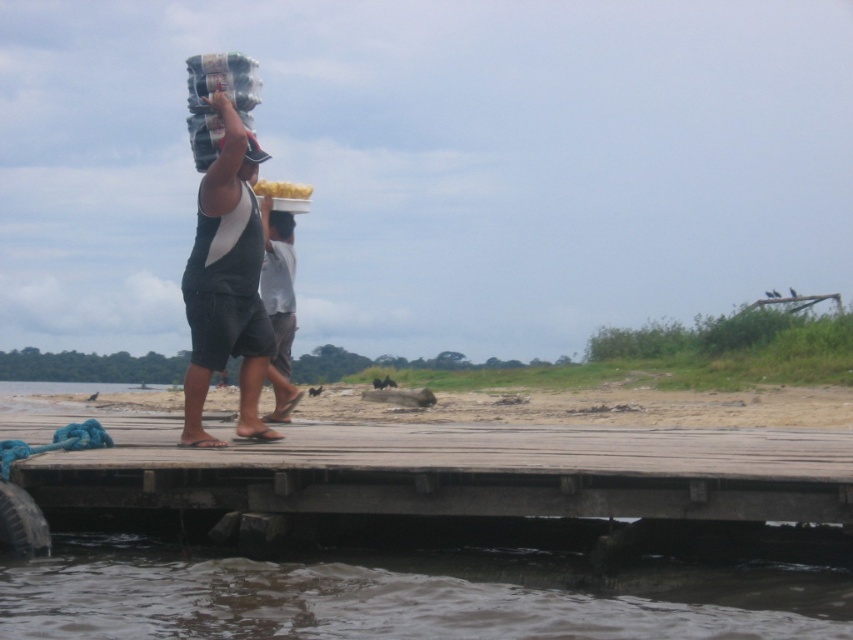
You are a visitor at the riverside dock. You notice the dark gray shorts at center and the brown murky water at lower left. Which object is positioned lower in the scene?

The brown murky water at lower left is positioned lower than the dark gray shorts at center.

You are standing at the point labeled point [274,221] and want to walk towards the point labeled point [115,481]. Which direction should you move relative to your current position?

Since point [115,481] is in front of point [274,221], you should move forward towards it.